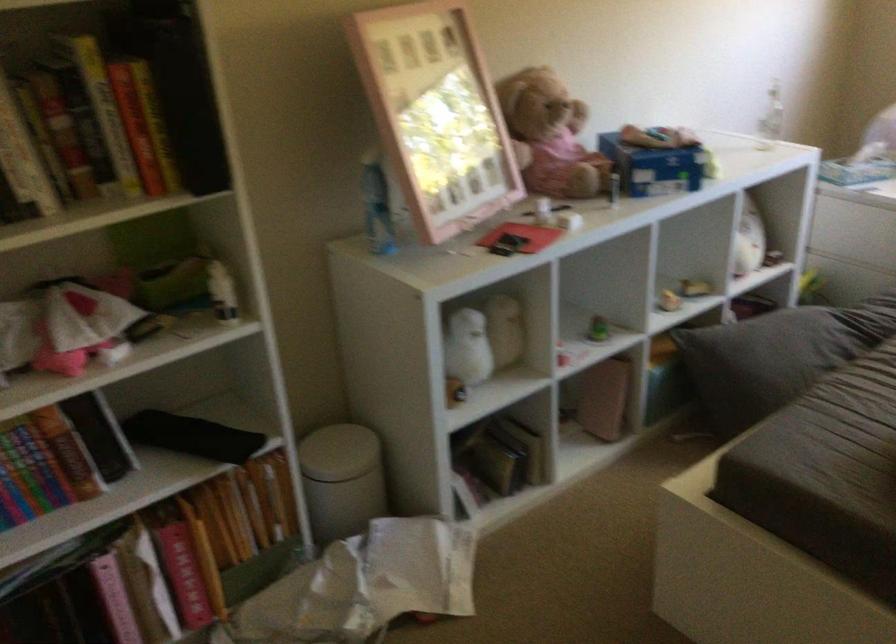
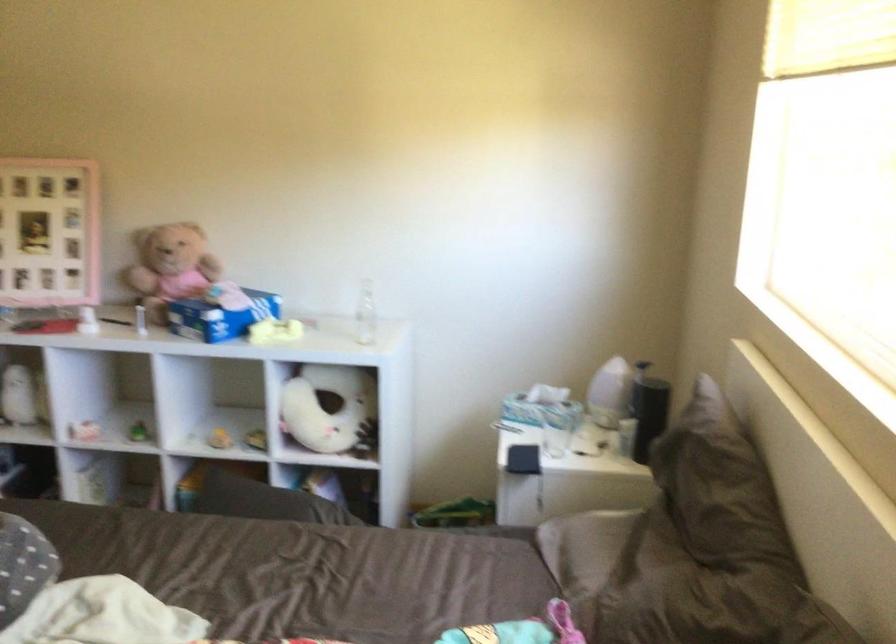
Where in the second image is the point corresponding to pixel 711 149 from the first image?

(220, 317)